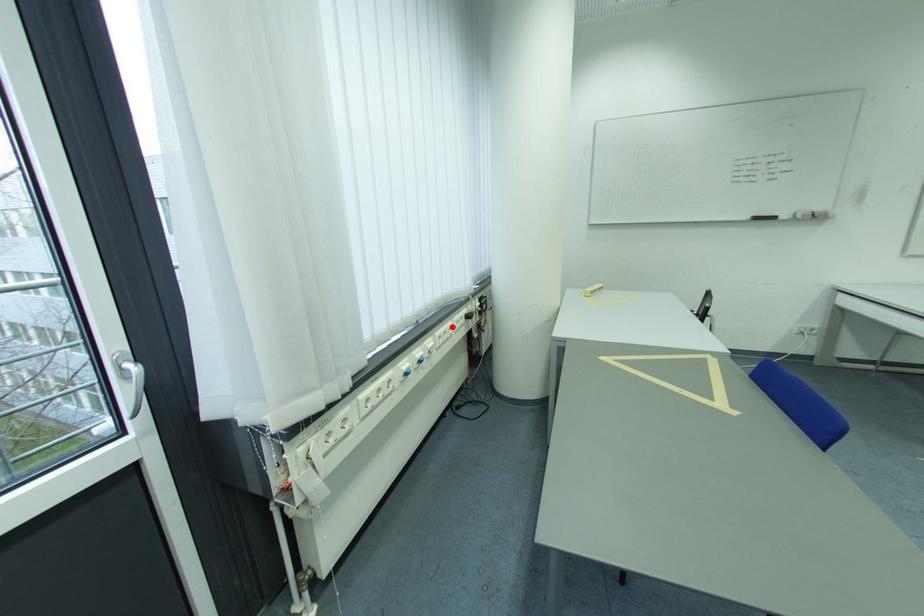
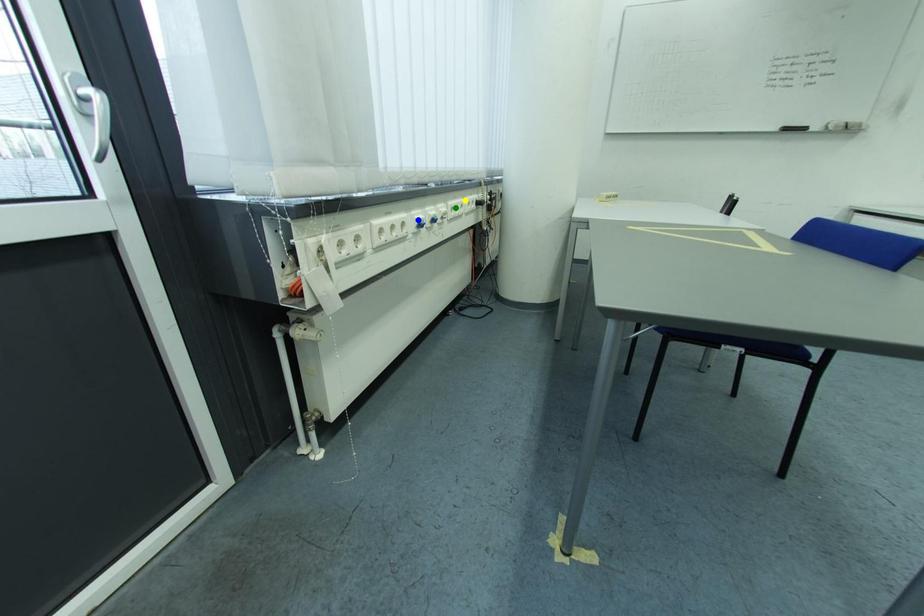
Question: I am providing you with two images of the same scene from different viewpoints. A red point is marked on the first image. You are given multiple points on the second image. In image 2, which mark is for the same physical point as the one in image 1?

Choices:
 (A) green point
 (B) blue point
 (C) yellow point

Answer: (C)